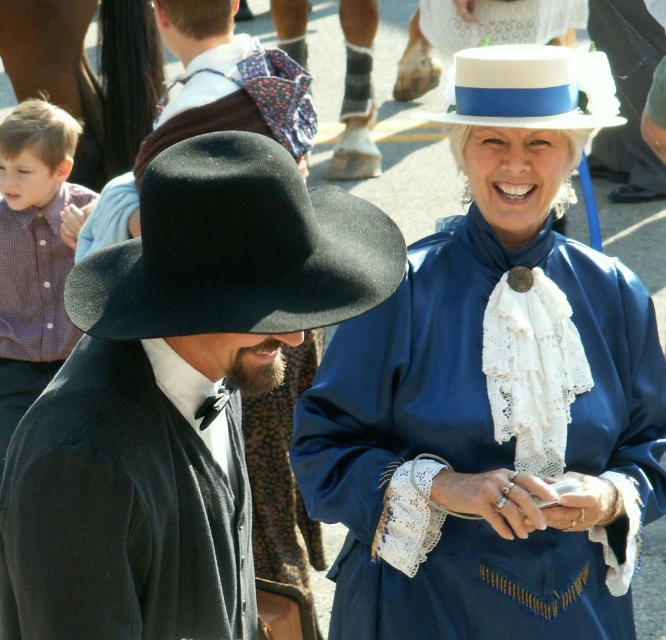
Question: Which of these objects is positioned farthest from the black felt hat at upper left?

Choices:
 (A) white felt dress hat at upper center
 (B) matte black hat at left
 (C) plaid shirt at left

Answer: (B)

Question: Is matte black hat at left positioned behind black felt cowboy hat at left?

Choices:
 (A) yes
 (B) no

Answer: (B)

Question: Can you confirm if matte black hat at left is thinner than white felt dress hat at upper center?

Choices:
 (A) yes
 (B) no

Answer: (B)

Question: Considering the relative positions of matte black hat at left and plaid shirt at left in the image provided, where is matte black hat at left located with respect to plaid shirt at left?

Choices:
 (A) left
 (B) right

Answer: (B)

Question: Which point is farther to the camera?

Choices:
 (A) (470, 83)
 (B) (87, 321)

Answer: (A)

Question: Which point is closer to the camera?

Choices:
 (A) (476, 192)
 (B) (49, 516)
 (C) (1, 253)

Answer: (B)